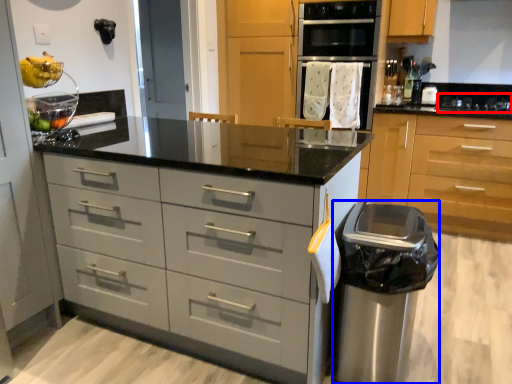
Question: Which of the following is the closest to the observer, gas stove (highlighted by a red box) or garbage (highlighted by a blue box)?

Choices:
 (A) gas stove
 (B) garbage

Answer: (B)